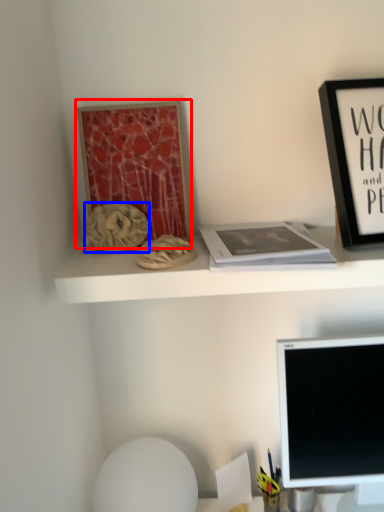
Question: Which of the following is the farthest to the observer, bulletin board (highlighted by a red box) or art (highlighted by a blue box)?

Choices:
 (A) bulletin board
 (B) art

Answer: (A)